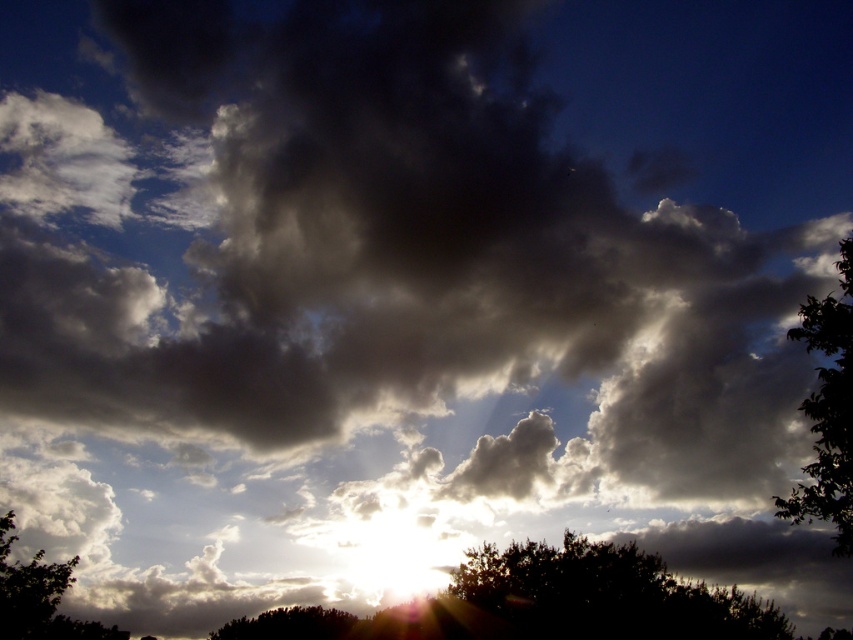
Question: Is black matte tree at center wider than green leafy tree at lower left?

Choices:
 (A) yes
 (B) no

Answer: (A)

Question: Is black matte tree at center below dark green leafy tree at right?

Choices:
 (A) yes
 (B) no

Answer: (A)

Question: Can you confirm if green leafy tree at lower left is bigger than dark green leafy tree at lower center?

Choices:
 (A) yes
 (B) no

Answer: (A)

Question: Which object appears closest to the camera in this image?

Choices:
 (A) black matte tree at center
 (B) green leafy tree at lower left
 (C) dark green leafy tree at lower center

Answer: (A)

Question: Based on their relative distances, which object is nearer to the dark green leafy tree at right?

Choices:
 (A) dark green leafy tree at lower center
 (B) black matte tree at center
 (C) green leafy tree at lower left

Answer: (B)

Question: Which object appears closest to the camera in this image?

Choices:
 (A) dark green leafy tree at right
 (B) green leafy tree at lower left

Answer: (A)